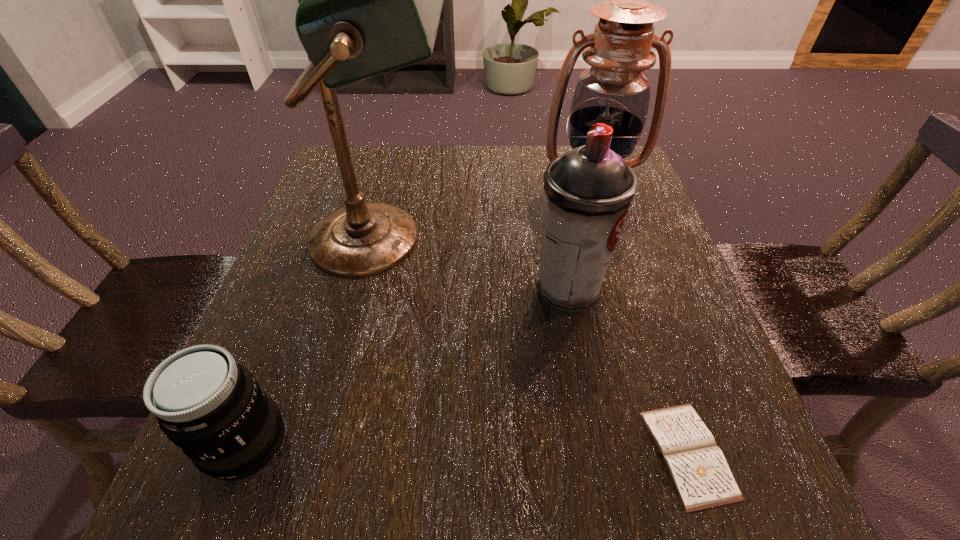
Where is `empty space that is in between the aerosol can and the shortest object`? This screenshot has width=960, height=540. empty space that is in between the aerosol can and the shortest object is located at coordinates (628, 372).

Identify the location of vacant area that lies between the oil lamp and the tallest object. (487, 213).

Where is `free area in between the oil lamp and the tallest object`? The width and height of the screenshot is (960, 540). free area in between the oil lamp and the tallest object is located at coordinates (487, 213).

This screenshot has height=540, width=960. What are the coordinates of `vacant space that is in between the shortest object and the third tallest object` in the screenshot? It's located at (628, 372).

Find the location of a particular element. Image resolution: width=960 pixels, height=540 pixels. free space between the second tallest object and the fourth tallest object is located at coordinates (419, 315).

The width and height of the screenshot is (960, 540). I want to click on unoccupied position between the telephoto lens and the fourth shortest object, so click(x=419, y=315).

Find the location of `vacant region between the telephoto lens and the second tallest object`. vacant region between the telephoto lens and the second tallest object is located at coordinates (419, 315).

Where is `object that is the third closest to the telephoto lens`? object that is the third closest to the telephoto lens is located at coordinates (697, 467).

Locate which object ranks second in proximity to the aerosol can. Please provide its 2D coordinates. Your answer should be formatted as a tuple, i.e. [(x, y)], where the tuple contains the x and y coordinates of a point satisfying the conditions above.

[(697, 467)]

In order to click on vacant space that satisfies the following two spatial constraints: 1. above the green lampshade of the tallest object; 2. on the right side of the shortest object in this screenshot , I will do `click(331, 454)`.